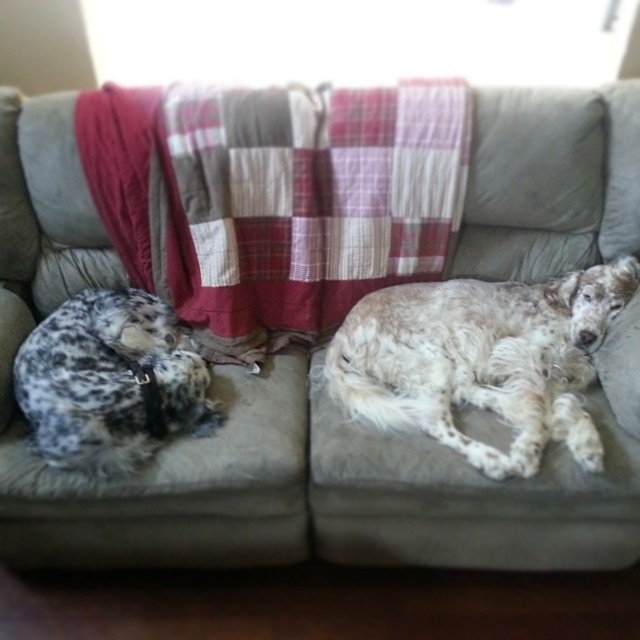
You are a pet sitter observing the two dogs on the beige sofa. The speckled fur dog at right and the spotted fur at left are both resting. Which dog is positioned higher up on the sofa?

The speckled fur dog at right is above the spotted fur at left, so it is positioned higher up on the sofa.

You are standing in the room and want to place a small basket on the sofa. The sofa has coordinates from point A at the bottom left corner to point B at the bottom right corner. The coordinates given are in the range of 0 to 1. Where should you place the basket so that it is not near the speckled fur dog at right located at point [481,360]?

To avoid placing the basket near the speckled fur dog at right located at point [481,360], you should place it in an area farther away from that coordinate, such as near the opposite end of the sofa or in a different section away from the dog.

You are a dog owner who wants to place a new plaid fabric blanket on the sofa. The current plaid fabric blanket at center is 3 feet wide. If the sofa is 8 feet long, can you place the new blanket 2 feet to the right of the existing one without overlapping?

The existing plaid fabric blanket at center is 3 feet wide, and they are 5.07 feet apart. Placing the new blanket 2 feet to the right of the existing one would leave 3.07 feet between them, which is more than enough space to prevent overlapping. Yes, you can place it there.